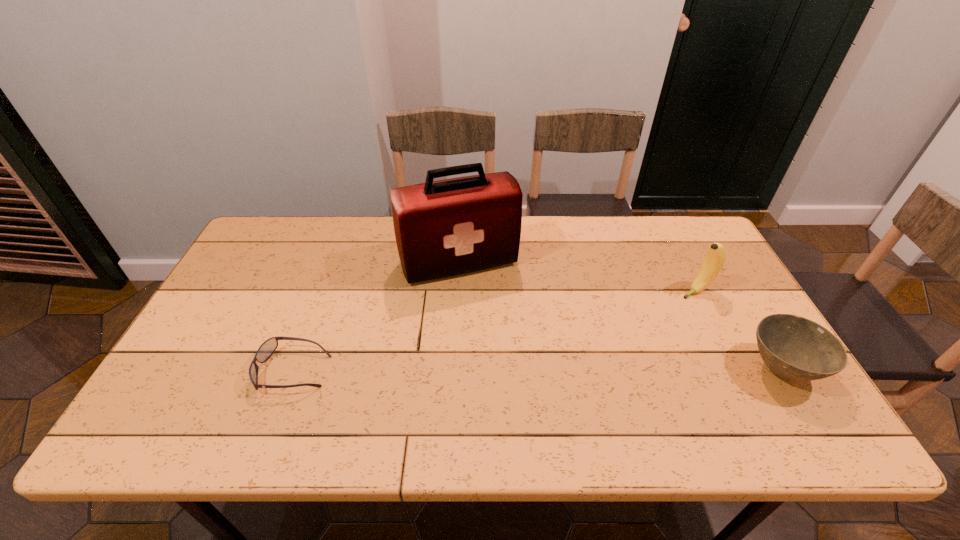
Find the location of a particular element. This screenshot has width=960, height=540. vacant position located 0.270m on the side of the tallest object with the cross symbol is located at coordinates click(x=506, y=360).

Image resolution: width=960 pixels, height=540 pixels. Find the location of `vacant position located 0.080m on the side of the tallest object with the cross symbol`. vacant position located 0.080m on the side of the tallest object with the cross symbol is located at coordinates (484, 307).

Where is `vacant space positioned 0.170m on the side of the tallest object with the cross symbol`? The width and height of the screenshot is (960, 540). vacant space positioned 0.170m on the side of the tallest object with the cross symbol is located at coordinates (493, 330).

Find the location of a particular element. vacant region located from the stem of the second tallest object is located at coordinates (579, 350).

The image size is (960, 540). I want to click on vacant space located from the stem of the second tallest object, so click(x=576, y=352).

Locate an element on the screen. The width and height of the screenshot is (960, 540). vacant space situated 0.060m from the stem of the second tallest object is located at coordinates (670, 303).

The image size is (960, 540). Identify the location of object located at the far edge. (449, 227).

Locate an element on the screen. sunglasses that is at the near edge is located at coordinates (267, 348).

The width and height of the screenshot is (960, 540). I want to click on bowl located at the near edge, so click(x=795, y=348).

Identify the location of bowl that is at the right edge. (795, 348).